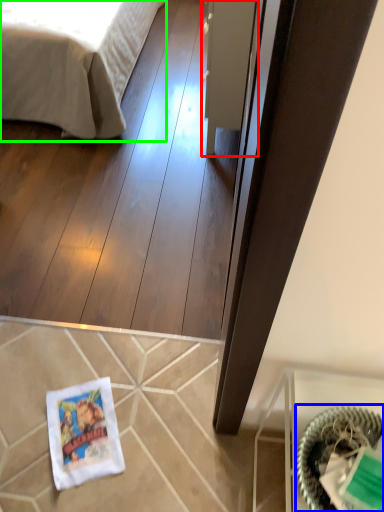
Question: Which is farther away from glass door (highlighted by a red box)? basket (highlighted by a blue box) or bed (highlighted by a green box)?

Choices:
 (A) basket
 (B) bed

Answer: (A)